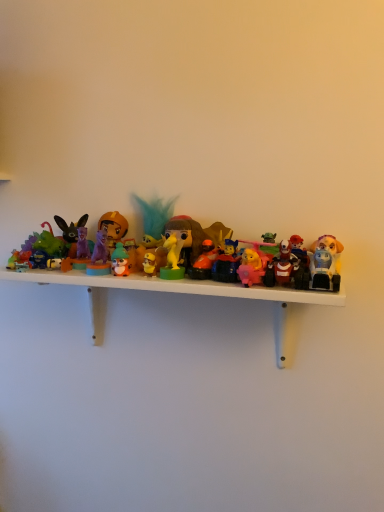
Image resolution: width=384 pixels, height=512 pixels. Describe the element at coordinates (113, 228) in the screenshot. I see `matte orange helmet at center, the fourth toy in the left-to-right sequence` at that location.

Where is `matte orange helmet at center, acting as the 10th toy starting from the right`? The width and height of the screenshot is (384, 512). matte orange helmet at center, acting as the 10th toy starting from the right is located at coordinates (113, 228).

Locate an element on the screen. The width and height of the screenshot is (384, 512). teal feather at center, arranged as the 6th toy when viewed from the left is located at coordinates (154, 218).

The image size is (384, 512). Describe the element at coordinates (195, 236) in the screenshot. I see `matte plastic toy at center, the 9th toy in the left-to-right sequence` at that location.

The width and height of the screenshot is (384, 512). What do you see at coordinates (204, 261) in the screenshot? I see `orange matte figure at center, acting as the 8th toy starting from the left` at bounding box center [204, 261].

In order to face matte plastic figure at center-right, which ranks as the twelfth toy in left-to-right order, should I rotate leftwards or rightwards?

Rotate your view right by about 11.491°.

Where is `matte orange helmet at center, the fourth toy in the left-to-right sequence`? Image resolution: width=384 pixels, height=512 pixels. matte orange helmet at center, the fourth toy in the left-to-right sequence is located at coordinates (113, 228).

Is pink plastic bear at center, arranged as the 11th toy when viewed from the left, placed right next to matte plastic figure at center-right, which ranks as the twelfth toy in left-to-right order?

Yes, pink plastic bear at center, arranged as the 11th toy when viewed from the left, and matte plastic figure at center-right, which ranks as the twelfth toy in left-to-right order, clearly make contact.

What are the coordinates of `toy that is in front of the pink plastic bear at center, arranged as the 11th toy when viewed from the left` in the screenshot? It's located at (284, 264).

From a real-world perspective, is pink plastic bear at center, arranged as the 11th toy when viewed from the left, positioned above or below matte plastic figure at center-right, the 2th toy when ordered from right to left?

pink plastic bear at center, arranged as the 11th toy when viewed from the left, is situated higher than matte plastic figure at center-right, the 2th toy when ordered from right to left, in the real world.

Which point is more distant from viewer, (259, 251) or (125, 249)?

The point (125, 249) is behind.

Considering the relative sizes of pink plastic bear at center, which is counted as the 3th toy, starting from the right, and matte green plush at center, the ninth toy positioned from the right, in the image provided, is pink plastic bear at center, which is counted as the 3th toy, starting from the right, smaller than matte green plush at center, the ninth toy positioned from the right,?

No.

In the scene shown: From the image's perspective, which is below, pink plastic bear at center, arranged as the 11th toy when viewed from the left, or matte green plush at center, the ninth toy positioned from the right?

From the image's view, pink plastic bear at center, arranged as the 11th toy when viewed from the left, is below.

Is pink plastic bear at center, which is counted as the 3th toy, starting from the right, wider than matte green plush at center, the ninth toy positioned from the right?

Yes, pink plastic bear at center, which is counted as the 3th toy, starting from the right, is wider than matte green plush at center, the ninth toy positioned from the right.

Considering the positions of objects pink plastic bear at center, which is counted as the 3th toy, starting from the right, and matte plastic toy at center, which is the fifth toy from right to left, in the image provided, who is more to the right, pink plastic bear at center, which is counted as the 3th toy, starting from the right, or matte plastic toy at center, which is the fifth toy from right to left,?

pink plastic bear at center, which is counted as the 3th toy, starting from the right, is more to the right.

Which of these two, pink plastic bear at center, arranged as the 11th toy when viewed from the left, or matte plastic toy at center, the 9th toy in the left-to-right sequence, is thinner?

pink plastic bear at center, arranged as the 11th toy when viewed from the left, is thinner.

Between pink plastic bear at center, arranged as the 11th toy when viewed from the left, and matte plastic toy at center, the 9th toy in the left-to-right sequence, which one has less height?

pink plastic bear at center, arranged as the 11th toy when viewed from the left, is shorter.

Looking at this image, which of these two, plush yellow dog at right, marked as the thirteenth toy in a left-to-right arrangement, or matte purple figurine at left, marked as the 11th toy in a right-to-left arrangement, is thinner?

Result: matte purple figurine at left, marked as the 11th toy in a right-to-left arrangement, is thinner.

In the scene shown: Relative to matte purple figurine at left, marked as the 11th toy in a right-to-left arrangement, is plush yellow dog at right, marked as the thirteenth toy in a left-to-right arrangement, in front or behind?

plush yellow dog at right, marked as the thirteenth toy in a left-to-right arrangement, is positioned closer to the viewer than matte purple figurine at left, marked as the 11th toy in a right-to-left arrangement.

Based on their positions, is plush yellow dog at right, marked as the thirteenth toy in a left-to-right arrangement, located to the left or right of matte purple figurine at left, which is the 3th toy in left-to-right order?

Clearly, plush yellow dog at right, marked as the thirteenth toy in a left-to-right arrangement, is on the right of matte purple figurine at left, which is the 3th toy in left-to-right order, in the image.

Do you think matte blue toy at left, positioned as the 1th toy in left-to-right order, is within matte orange helmet at center, acting as the 10th toy starting from the right, or outside of it?

matte blue toy at left, positioned as the 1th toy in left-to-right order, is located beyond the bounds of matte orange helmet at center, acting as the 10th toy starting from the right.

From a real-world perspective, which object rests below the other?

matte blue toy at left, positioned as the 1th toy in left-to-right order, is physically lower.

Does point (17, 257) come behind point (103, 214)?

No, (17, 257) is in front of (103, 214).

Are matte blue toy at left, positioned as the 1th toy in left-to-right order, and matte orange helmet at center, acting as the 10th toy starting from the right, located far from each other?

No, matte blue toy at left, positioned as the 1th toy in left-to-right order, is not far from matte orange helmet at center, acting as the 10th toy starting from the right.

From a real-world perspective, is matte plastic figure at center-right, which ranks as the twelfth toy in left-to-right order, located higher than matte black rabbit at left, acting as the 2th toy starting from the left?

No.

Which object is positioned more to the left, matte plastic figure at center-right, the 2th toy when ordered from right to left, or matte black rabbit at left, the 12th toy positioned from the right?

From the viewer's perspective, matte black rabbit at left, the 12th toy positioned from the right, appears more on the left side.

Based on the photo, which of these two, matte plastic figure at center-right, the 2th toy when ordered from right to left, or matte black rabbit at left, the 12th toy positioned from the right, is wider?

Wider between the two is matte black rabbit at left, the 12th toy positioned from the right.

Measure the distance between matte plastic figure at center-right, which ranks as the twelfth toy in left-to-right order, and matte black rabbit at left, acting as the 2th toy starting from the left.

matte plastic figure at center-right, which ranks as the twelfth toy in left-to-right order, and matte black rabbit at left, acting as the 2th toy starting from the left, are 15.12 inches apart from each other.

From the image's perspective, is matte green plush at center, the ninth toy positioned from the right, above or below matte plastic toy at center, which is the fifth toy from right to left?

matte green plush at center, the ninth toy positioned from the right, is situated lower than matte plastic toy at center, which is the fifth toy from right to left, in the image.

Is matte green plush at center, the 5th toy in the left-to-right sequence, not inside matte plastic toy at center, the 9th toy in the left-to-right sequence?

That's correct, matte green plush at center, the 5th toy in the left-to-right sequence, is outside of matte plastic toy at center, the 9th toy in the left-to-right sequence.

Between matte green plush at center, the ninth toy positioned from the right, and matte plastic toy at center, which is the fifth toy from right to left, which one has larger size?

matte plastic toy at center, which is the fifth toy from right to left.

Who is more distant, matte green plush at center, the ninth toy positioned from the right, or matte plastic toy at center, which is the fifth toy from right to left?

matte plastic toy at center, which is the fifth toy from right to left, is behind.

Starting from the matte plastic figure at center-right, which ranks as the twelfth toy in left-to-right order, which toy is the 1st one behind? Please provide its 2D coordinates.

[(252, 266)]

Identify the location of toy that is the 6th one when counting rightward from the matte green plush at center, the ninth toy positioned from the right. (252, 266).

Which object lies further to the anchor point matte plastic toy at center, which is the fifth toy from right to left, matte purple figurine at left, which is the 3th toy in left-to-right order, or plush yellow dog at right, positioned as the 1th toy in right-to-left order?

Based on the image, plush yellow dog at right, positioned as the 1th toy in right-to-left order, appears to be further to matte plastic toy at center, which is the fifth toy from right to left.

In the scene shown: From the image, which object appears to be farther from matte orange helmet at center, acting as the 10th toy starting from the right, matte purple figurine at left, which is the 3th toy in left-to-right order, or matte plastic figure at center-right, the 2th toy when ordered from right to left?

matte plastic figure at center-right, the 2th toy when ordered from right to left, lies further to matte orange helmet at center, acting as the 10th toy starting from the right, than the other object.

Estimate the real-world distances between objects in this image. Which object is further from matte plastic figure at center-right, which ranks as the twelfth toy in left-to-right order, orange matte figure at center, acting as the 8th toy starting from the left, or plush yellow dog at right, marked as the thirteenth toy in a left-to-right arrangement?

Based on the image, orange matte figure at center, acting as the 8th toy starting from the left, appears to be further to matte plastic figure at center-right, which ranks as the twelfth toy in left-to-right order.

Estimate the real-world distances between objects in this image. Which object is further from plastic toys at center, translucent yellow toy at center, which is counted as the 7th toy, starting from the left, or matte black rabbit at left, acting as the 2th toy starting from the left?

matte black rabbit at left, acting as the 2th toy starting from the left, is further to plastic toys at center.

From the image, which object appears to be nearer to matte blue toy at left, positioned as the 1th toy in left-to-right order, matte plastic figure at center-right, the 2th toy when ordered from right to left, or matte green plush at center, the 5th toy in the left-to-right sequence?

The object closer to matte blue toy at left, positioned as the 1th toy in left-to-right order, is matte green plush at center, the 5th toy in the left-to-right sequence.

Looking at the image, which one is located further to matte green plush at center, the ninth toy positioned from the right, teal feather at center, arranged as the 6th toy when viewed from the left, or matte purple figurine at left, marked as the 11th toy in a right-to-left arrangement?

Based on the image, teal feather at center, arranged as the 6th toy when viewed from the left, appears to be further to matte green plush at center, the ninth toy positioned from the right.

Estimate the real-world distances between objects in this image. Which object is closer to matte plastic toy at center, which is the fifth toy from right to left, matte orange helmet at center, the fourth toy in the left-to-right sequence, or plush yellow dog at right, marked as the thirteenth toy in a left-to-right arrangement?

The object closer to matte plastic toy at center, which is the fifth toy from right to left, is matte orange helmet at center, the fourth toy in the left-to-right sequence.

Based on their spatial positions, is matte plastic figure at center-right, which ranks as the twelfth toy in left-to-right order, or matte orange helmet at center, the fourth toy in the left-to-right sequence, closer to matte purple figurine at left, which is the 3th toy in left-to-right order?

Among the two, matte orange helmet at center, the fourth toy in the left-to-right sequence, is located nearer to matte purple figurine at left, which is the 3th toy in left-to-right order.

Where is `toy between pink plastic bear at center, which is counted as the 3th toy, starting from the right, and plush yellow dog at right, positioned as the 1th toy in right-to-left order`? toy between pink plastic bear at center, which is counted as the 3th toy, starting from the right, and plush yellow dog at right, positioned as the 1th toy in right-to-left order is located at coordinates (284, 264).

Locate an element on the screen. shelf between teal feather at center, arranged as the 6th toy when viewed from the left, and plush yellow dog at right, positioned as the 1th toy in right-to-left order is located at coordinates (179, 293).

Find the location of `shelf between matte black rabbit at left, the 12th toy positioned from the right, and shiny plastic figure at center, placed as the tenth toy when sorted from left to right, from left to right`. shelf between matte black rabbit at left, the 12th toy positioned from the right, and shiny plastic figure at center, placed as the tenth toy when sorted from left to right, from left to right is located at coordinates (179, 293).

Where is `shelf between matte orange helmet at center, acting as the 10th toy starting from the right, and matte plastic figure at center-right, which ranks as the twelfth toy in left-to-right order, in the horizontal direction`? This screenshot has width=384, height=512. shelf between matte orange helmet at center, acting as the 10th toy starting from the right, and matte plastic figure at center-right, which ranks as the twelfth toy in left-to-right order, in the horizontal direction is located at coordinates click(x=179, y=293).